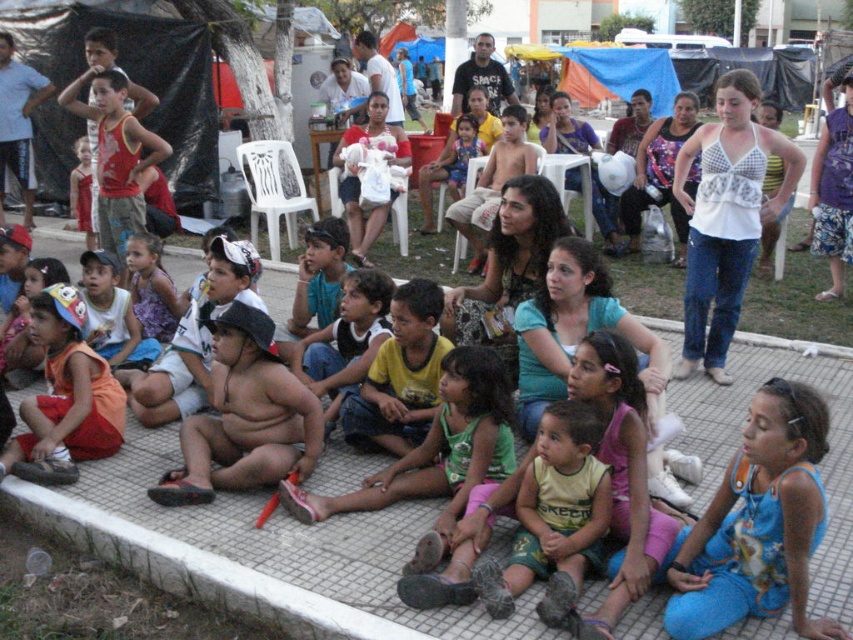
Is fat child at center shorter than orange cotton shirt at lower left?

Indeed, fat child at center has a lesser height compared to orange cotton shirt at lower left.

Locate an element on the screen. fat child at center is located at coordinates (244, 417).

Locate an element on the screen. fat child at center is located at coordinates (244, 417).

Is white tile curb at lower left further to the viewer compared to yellow-green fabric at center?

No.

Does white tile curb at lower left have a smaller size compared to yellow-green fabric at center?

Actually, white tile curb at lower left might be larger than yellow-green fabric at center.

Is point (199, 552) more distant than point (544, 577)?

Yes, it is behind point (544, 577).

Locate an element on the screen. The image size is (853, 640). white tile curb at lower left is located at coordinates (194, 570).

Does white tile curb at lower left lie in front of orange cotton shirt at lower left?

That is True.

Which of these two, white tile curb at lower left or orange cotton shirt at lower left, stands taller?

orange cotton shirt at lower left is taller.

Between point (347, 614) and point (105, 397), which one is positioned behind?

The point (105, 397) is behind.

This screenshot has width=853, height=640. Identify the location of white tile curb at lower left. (194, 570).